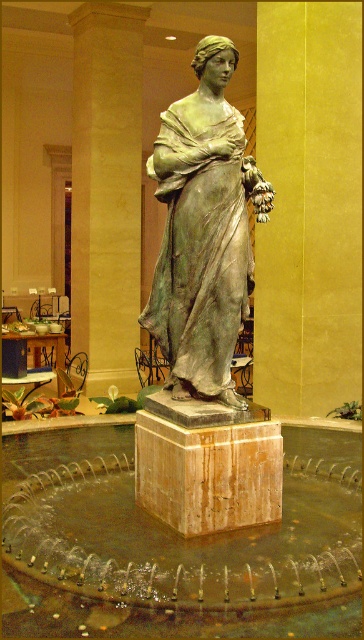
You are an architect inspecting the indoor space. You notice the green patina statue at center and the green marble pillar at center. Based on their positions, which one is closer to the floor?

The green patina statue at center is closer to the floor because it is positioned below the green marble pillar at center.

You are a tour guide explaining the layout of the indoor space. You want to mention the green patina statue at center and the green marble pillar at center. How are their positions related to each other?

The green patina statue at center is positioned in front of the green marble pillar at center, meaning the statue is closer to the viewer while the pillar is situated behind it.

You are standing in front of the classical statue in the image. You want to take a photo of the statue from a position that is exactly 3.41 meters away from the point at coordinates point [219,342]. Can you do that?

Yes, since the camera is already 3.41 meters away from the point [219,342], you can take the photo from your current position.